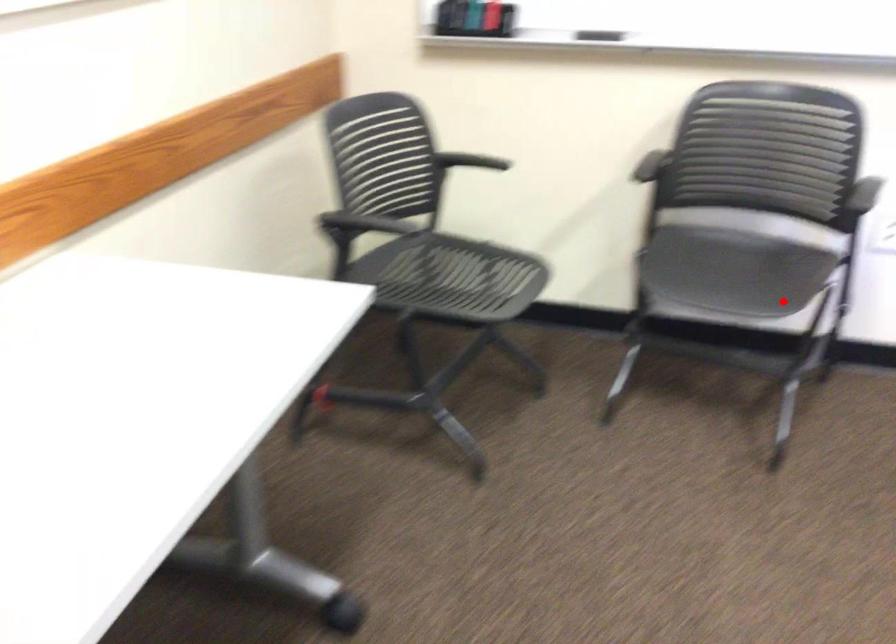
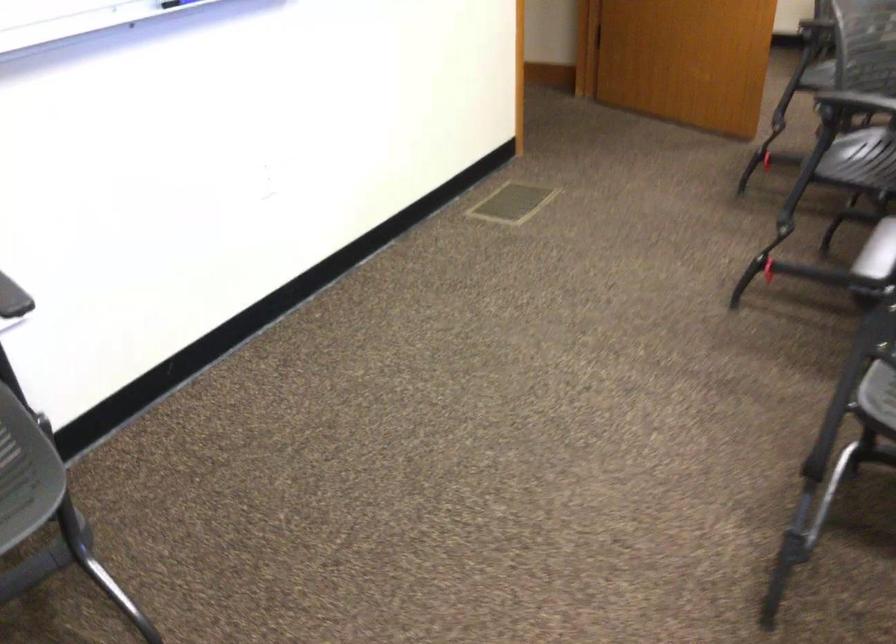
Question: I am providing you with two images of the same scene from different viewpoints. A red point is shown in image1. For the corresponding object point in image2, is it positioned nearer or farther from the camera?

Choices:
 (A) Nearer
 (B) Farther

Answer: (A)